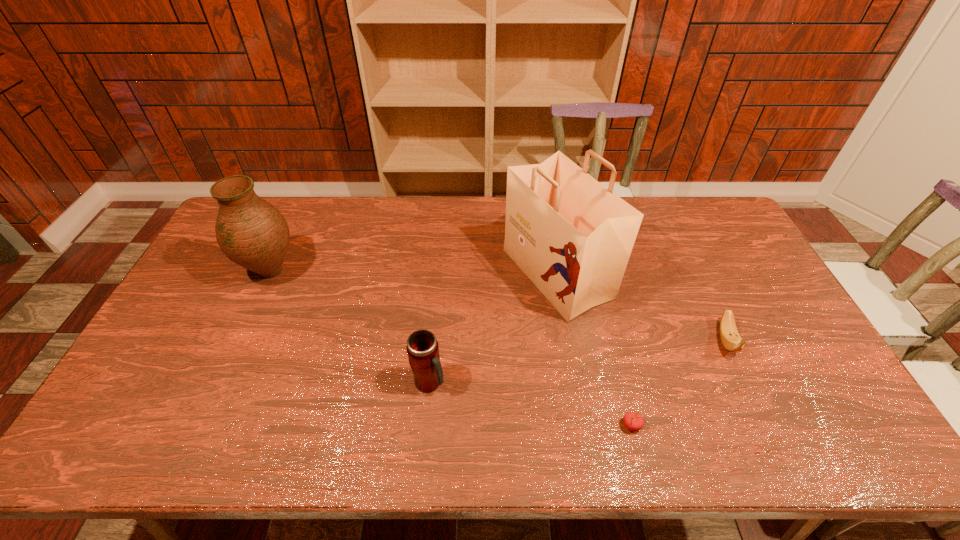
This screenshot has height=540, width=960. Find the location of `object identified as the second closest to the rightmost object`. object identified as the second closest to the rightmost object is located at coordinates (633, 421).

Locate an element on the screen. Image resolution: width=960 pixels, height=540 pixels. object that is the fourth closest to the thermos bottle is located at coordinates (730, 338).

The height and width of the screenshot is (540, 960). Identify the location of free location that satisfies the following two spatial constraints: 1. on the side of the tallest object with the superhero design; 2. on the right side of the banana. (568, 340).

At what (x,y) coordinates should I click in order to perform the action: click on vacant space that satisfies the following two spatial constraints: 1. on the side of the banana with the superhero design; 2. on the left side of the grocery bag. Please return your answer as a coordinate pair (x, y). Image resolution: width=960 pixels, height=540 pixels. Looking at the image, I should click on (568, 340).

Find the location of `free spot that satisfies the following two spatial constraints: 1. on the side of the grocery bag with the superhero design; 2. on the left side of the cherry`. free spot that satisfies the following two spatial constraints: 1. on the side of the grocery bag with the superhero design; 2. on the left side of the cherry is located at coordinates (583, 426).

At what (x,y) coordinates should I click in order to perform the action: click on free location that satisfies the following two spatial constraints: 1. on the side of the tallest object with the superhero design; 2. on the back side of the nearest object. Please return your answer as a coordinate pair (x, y). The height and width of the screenshot is (540, 960). Looking at the image, I should click on (583, 426).

Where is `free space that satisfies the following two spatial constraints: 1. on the side of the rightmost object with the superhero design; 2. on the left side of the grocery bag`? free space that satisfies the following two spatial constraints: 1. on the side of the rightmost object with the superhero design; 2. on the left side of the grocery bag is located at coordinates (568, 340).

Where is `free space in the image that satisfies the following two spatial constraints: 1. on the side with the handle of the third tallest object; 2. on the left side of the cherry`? The height and width of the screenshot is (540, 960). free space in the image that satisfies the following two spatial constraints: 1. on the side with the handle of the third tallest object; 2. on the left side of the cherry is located at coordinates (426, 426).